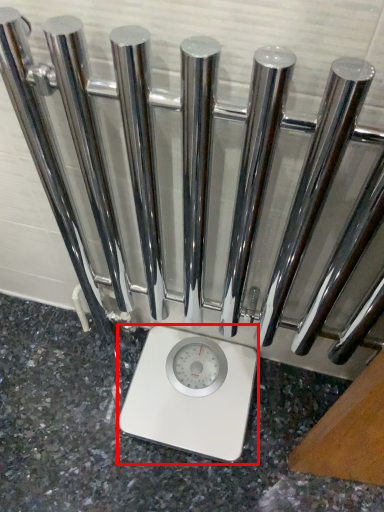
Question: In this image, where is scale (annotated by the red box) located relative to granite?

Choices:
 (A) left
 (B) right

Answer: (B)